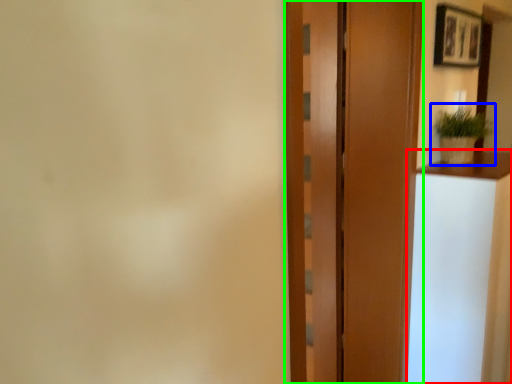
Question: Based on their relative distances, which object is nearer to vanity (highlighted by a red box)? Choose from houseplant (highlighted by a blue box) and door (highlighted by a green box).

Choices:
 (A) houseplant
 (B) door

Answer: (B)